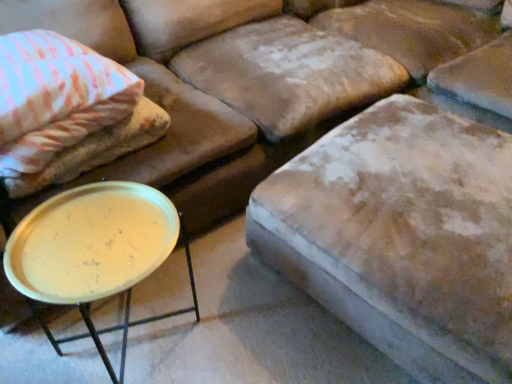
What do you see at coordinates (94, 251) in the screenshot? I see `metallic gold tray at lower left` at bounding box center [94, 251].

What is the approximate height of pink striped fabric pillow at upper left?

The height of pink striped fabric pillow at upper left is 9.70 inches.

Find the location of a particular element. The width and height of the screenshot is (512, 384). velvet beige ottoman at center is located at coordinates (402, 236).

From a real-world perspective, is velvet beige ottoman at center physically located above or below metallic gold tray at lower left?

velvet beige ottoman at center is situated lower than metallic gold tray at lower left in the real world.

Can you tell me how much velvet beige ottoman at center and metallic gold tray at lower left differ in facing direction?

The facing directions of velvet beige ottoman at center and metallic gold tray at lower left are 6.43 degrees apart.

Considering the sizes of velvet beige ottoman at center and metallic gold tray at lower left in the image, is velvet beige ottoman at center taller or shorter than metallic gold tray at lower left?

In the image, velvet beige ottoman at center appears to be shorter than metallic gold tray at lower left.

Is velvet beige ottoman at center in front of or behind metallic gold tray at lower left in the image?

velvet beige ottoman at center is in front of metallic gold tray at lower left.

Locate an element on the screen. This screenshot has height=384, width=512. swivel chair located in front of the metallic gold tray at lower left is located at coordinates (402, 236).

From a real-world perspective, between metallic gold tray at lower left and velvet beige ottoman at center, who is vertically lower?

In real-world perspective, velvet beige ottoman at center is lower.

Is metallic gold tray at lower left oriented towards velvet beige ottoman at center?

No, metallic gold tray at lower left is not oriented towards velvet beige ottoman at center.

Consider the image. How many degrees apart are the facing directions of metallic gold tray at lower left and velvet beige ottoman at center?

metallic gold tray at lower left and velvet beige ottoman at center are facing 6.43 degrees away from each other.

Does point (118, 248) come behind point (116, 67)?

No, (118, 248) is closer to viewer.

Considering the sizes of objects metallic gold tray at lower left and pink striped fabric pillow at upper left in the image provided, who is bigger, metallic gold tray at lower left or pink striped fabric pillow at upper left?

With larger size is metallic gold tray at lower left.

Are metallic gold tray at lower left and pink striped fabric pillow at upper left beside each other?

metallic gold tray at lower left and pink striped fabric pillow at upper left are clearly separated.

Is metallic gold tray at lower left not inside pink striped fabric pillow at upper left?

Yes, metallic gold tray at lower left is outside of pink striped fabric pillow at upper left.

Which object is positioned more to the right, pink striped fabric pillow at upper left or velvet beige ottoman at center?

From the viewer's perspective, velvet beige ottoman at center appears more on the right side.

Identify the location of pillow that is above the velvet beige ottoman at center (from the image's perspective). This screenshot has width=512, height=384. (58, 90).

From the image's perspective, would you say pink striped fabric pillow at upper left is shown under velvet beige ottoman at center?

No, from the image's perspective, pink striped fabric pillow at upper left is not beneath velvet beige ottoman at center.

From the picture: Considering the sizes of pink striped fabric pillow at upper left and velvet beige ottoman at center in the image, is pink striped fabric pillow at upper left bigger or smaller than velvet beige ottoman at center?

In the image, pink striped fabric pillow at upper left appears to be smaller than velvet beige ottoman at center.

From a real-world perspective, is velvet beige ottoman at center under pink striped fabric pillow at upper left?

Indeed, from a real-world perspective, velvet beige ottoman at center is positioned beneath pink striped fabric pillow at upper left.

Is pink striped fabric pillow at upper left located within velvet beige ottoman at center?

No, pink striped fabric pillow at upper left is located outside of velvet beige ottoman at center.

Is velvet beige ottoman at center oriented away from pink striped fabric pillow at upper left?

Yes, velvet beige ottoman at center is positioned with its back facing pink striped fabric pillow at upper left.

Considering the positions of objects velvet beige ottoman at center and pink striped fabric pillow at upper left in the image provided, who is behind, velvet beige ottoman at center or pink striped fabric pillow at upper left?

Positioned behind is pink striped fabric pillow at upper left.

Consider the image. In terms of width, does pink striped fabric pillow at upper left look wider or thinner when compared to metallic gold tray at lower left?

pink striped fabric pillow at upper left is wider than metallic gold tray at lower left.

Does pink striped fabric pillow at upper left have a smaller size compared to metallic gold tray at lower left?

Yes, pink striped fabric pillow at upper left is smaller than metallic gold tray at lower left.

Is pink striped fabric pillow at upper left positioned far away from metallic gold tray at lower left?

pink striped fabric pillow at upper left is near metallic gold tray at lower left, not far away.

Can you confirm if pink striped fabric pillow at upper left is positioned to the left of metallic gold tray at lower left?

Yes, pink striped fabric pillow at upper left is to the left of metallic gold tray at lower left.

Where is `round table on the left of the velvet beige ottoman at center`? The height and width of the screenshot is (384, 512). round table on the left of the velvet beige ottoman at center is located at coordinates (94, 251).

What are the coordinates of `swivel chair on the right of metallic gold tray at lower left` in the screenshot? It's located at (402, 236).

Which object lies nearer to the anchor point metallic gold tray at lower left, pink striped fabric pillow at upper left or velvet beige ottoman at center?

pink striped fabric pillow at upper left lies closer to metallic gold tray at lower left than the other object.

Considering their positions, is velvet beige ottoman at center positioned further to pink striped fabric pillow at upper left than metallic gold tray at lower left?

The object further to pink striped fabric pillow at upper left is velvet beige ottoman at center.

Based on their spatial positions, is velvet beige ottoman at center or pink striped fabric pillow at upper left further from metallic gold tray at lower left?

Based on the image, velvet beige ottoman at center appears to be further to metallic gold tray at lower left.

When comparing their distances from velvet beige ottoman at center, does pink striped fabric pillow at upper left or metallic gold tray at lower left seem closer?

The object closer to velvet beige ottoman at center is metallic gold tray at lower left.

Which object lies nearer to the anchor point velvet beige ottoman at center, metallic gold tray at lower left or pink striped fabric pillow at upper left?

metallic gold tray at lower left is positioned closer to the anchor velvet beige ottoman at center.

Based on their spatial positions, is metallic gold tray at lower left or velvet beige ottoman at center closer to pink striped fabric pillow at upper left?

Among the two, metallic gold tray at lower left is located nearer to pink striped fabric pillow at upper left.

Identify the location of round table between pink striped fabric pillow at upper left and velvet beige ottoman at center in the horizontal direction. The image size is (512, 384). (94, 251).